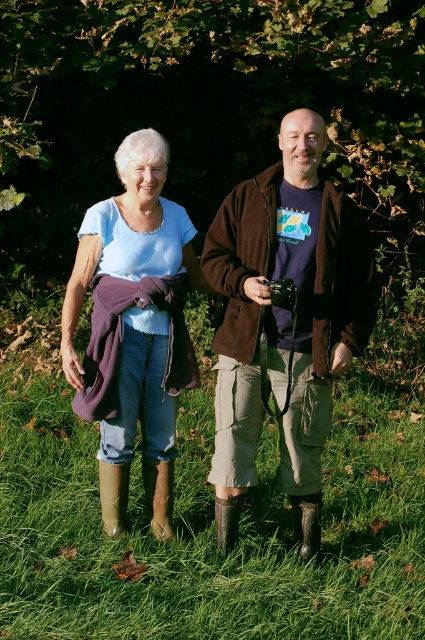
Who is shorter, brown suede jacket at center or matte purple scarf at left?

With less height is matte purple scarf at left.

Is point (337, 230) closer to viewer compared to point (155, 244)?

That is True.

Find the location of a particular element. This screenshot has height=640, width=425. brown suede jacket at center is located at coordinates (285, 320).